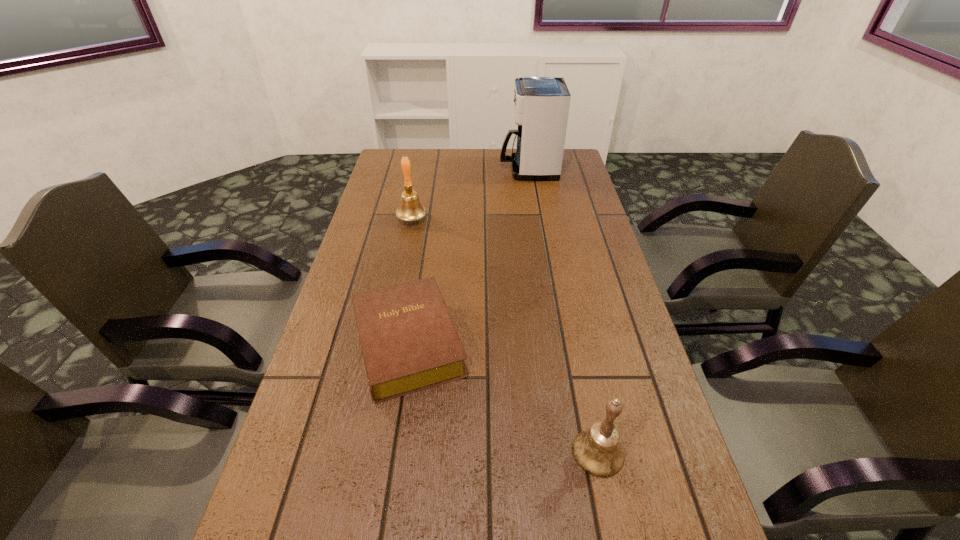
Locate an element on the screen. This screenshot has width=960, height=540. coffee maker is located at coordinates (541, 104).

Image resolution: width=960 pixels, height=540 pixels. Identify the location of the farthest object. (541, 104).

You are a GUI agent. You are given a task and a screenshot of the screen. Output one action in this format:
    pyautogui.click(x=<x>, y=<y>)
    Task: Click on the second tallest object
    The width and height of the screenshot is (960, 540).
    Given the screenshot: What is the action you would take?
    pyautogui.click(x=410, y=209)

In order to click on the left bell in this screenshot , I will do `click(410, 209)`.

You are a GUI agent. You are given a task and a screenshot of the screen. Output one action in this format:
    pyautogui.click(x=<x>, y=<y>)
    Task: Click on the nearest object
    
    Given the screenshot: What is the action you would take?
    pyautogui.click(x=597, y=450)

Find the location of `the shorter bell`. the shorter bell is located at coordinates (597, 450).

In order to click on the shortest object in this screenshot , I will do `click(409, 342)`.

At what (x,y) coordinates should I click in order to perform the action: click on Bible. Please return your answer as a coordinate pair (x, y). The height and width of the screenshot is (540, 960). Looking at the image, I should click on (409, 342).

The width and height of the screenshot is (960, 540). I want to click on free space located on the front panel of the coffee maker, so (x=463, y=170).

At what (x,y) coordinates should I click in order to perform the action: click on vacant space located on the front panel of the coffee maker. Please return your answer as a coordinate pair (x, y). Looking at the image, I should click on (452, 170).